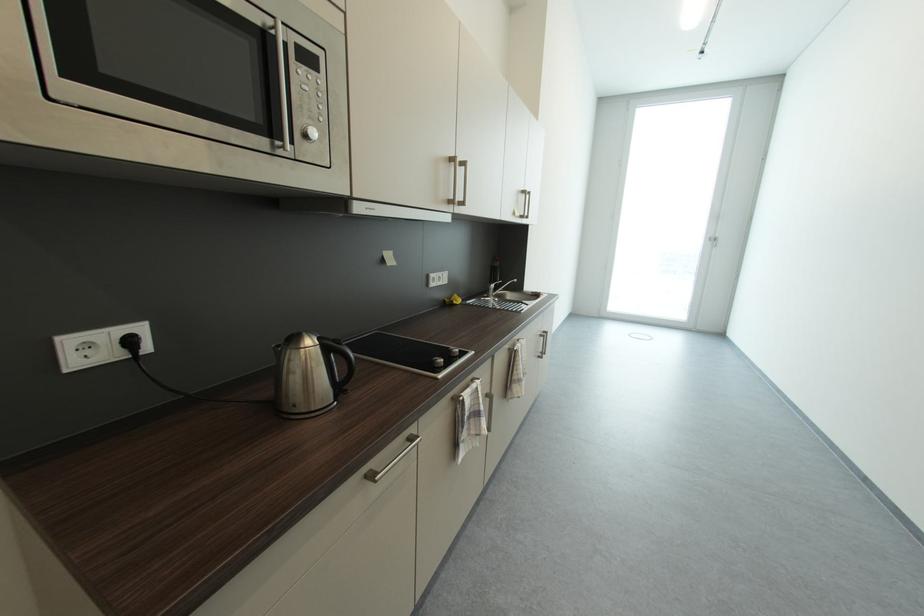
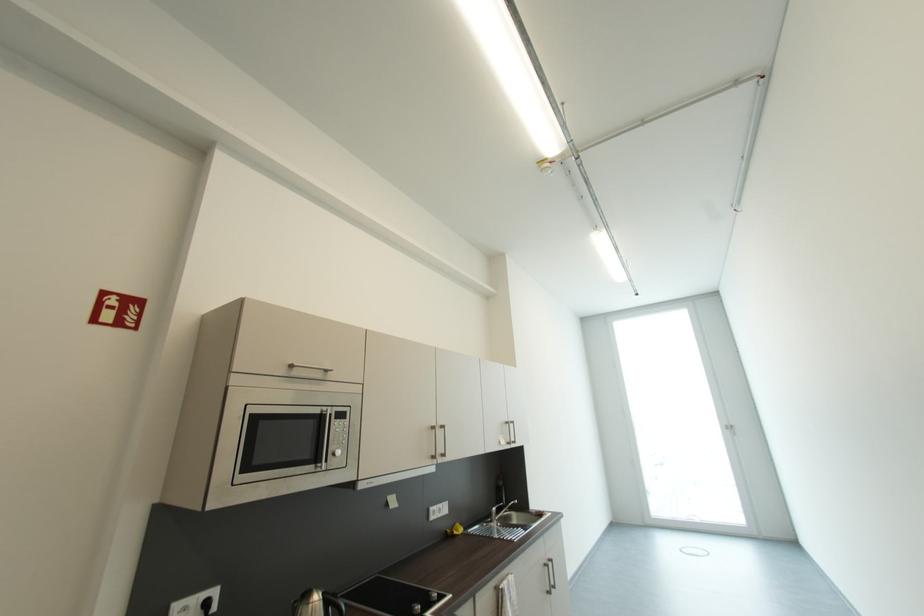
Find the pixel in the second image that matches (x=548, y=338) in the first image.

(552, 567)